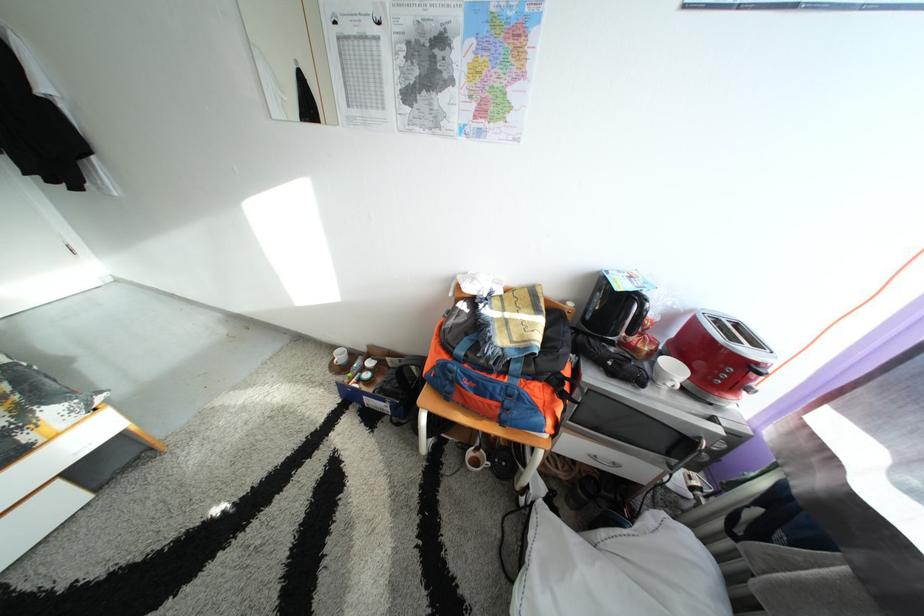
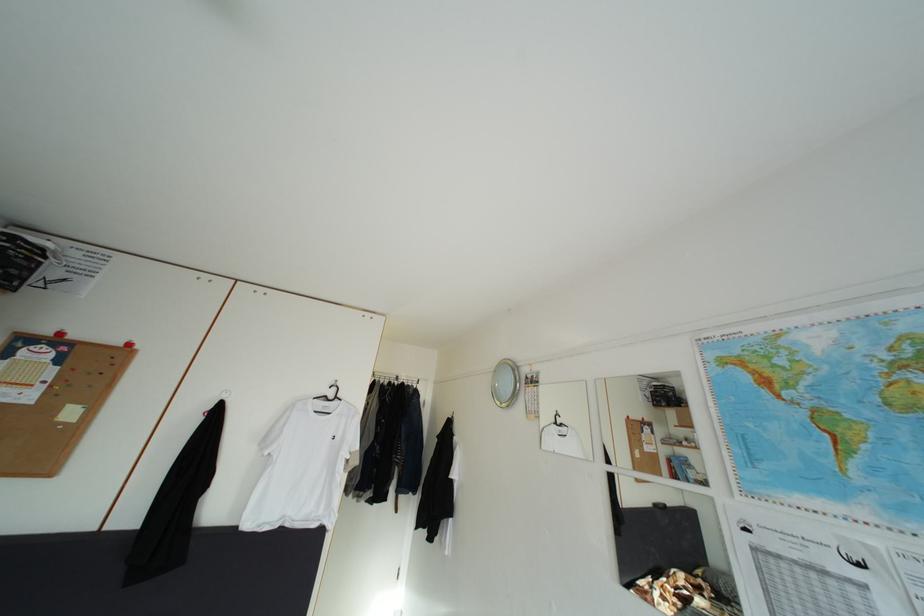
How did the camera likely rotate?

Answer: The camera's rotation is toward left-up.